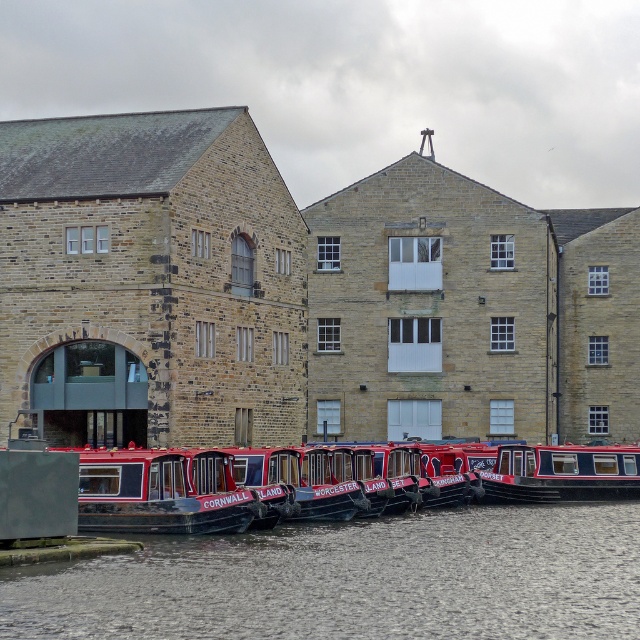
Is point (80, 499) closer to viewer compared to point (324, 464)?

Yes, it is in front of point (324, 464).

Does point (196, 458) lie behind point (316, 506)?

No, it is not.

Identify the location of metallic red canal boat at center. (161, 492).

Does smooth gray water at lower center appear on the right side of red polished wood boat at center?

Correct, you'll find smooth gray water at lower center to the right of red polished wood boat at center.

Who is higher up, smooth gray water at lower center or red polished wood boat at center?

red polished wood boat at center

Locate an element on the screen. This screenshot has height=640, width=640. smooth gray water at lower center is located at coordinates (353, 579).

Find the location of a particular element. smooth gray water at lower center is located at coordinates (353, 579).

Is smooth gray water at lower center shorter than metallic red canal boat at center?

Yes.

Consider the image. Between smooth gray water at lower center and metallic red canal boat at center, which one is positioned higher?

metallic red canal boat at center is above.

Does point (593, 628) come in front of point (237, 492)?

Yes, point (593, 628) is closer to viewer.

This screenshot has width=640, height=640. Find the location of `smooth gray water at lower center`. smooth gray water at lower center is located at coordinates (353, 579).